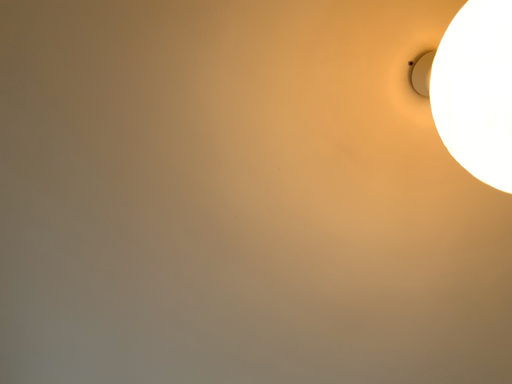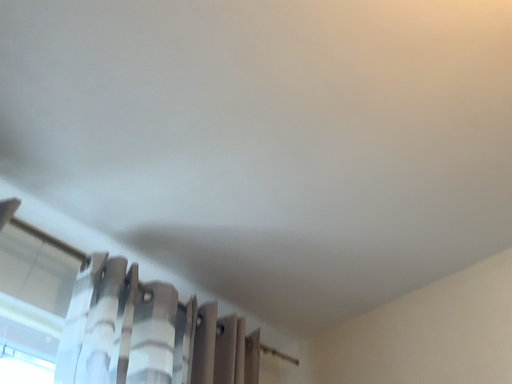
Question: How did the camera likely rotate when shooting the video?

Choices:
 (A) rotated downward
 (B) rotated upward

Answer: (A)